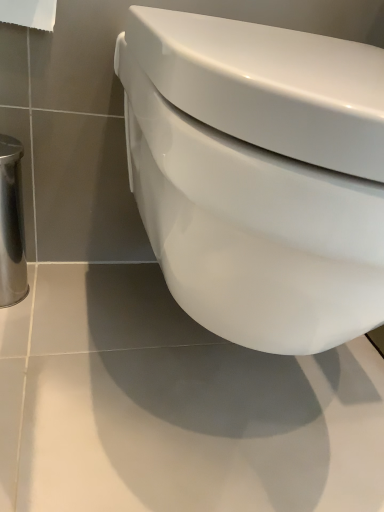
Describe the element at coordinates (258, 175) in the screenshot. I see `white glossy toilet at center` at that location.

What is the approximate width of white glossy toilet at center?

It is 20.89 inches.

Where is `white glossy toilet at center`? white glossy toilet at center is located at coordinates (258, 175).

From the picture: In order to face white paper at upper left, should I rotate leftwards or rightwards?

Turn left by 25.678 degrees to look at white paper at upper left.

Describe the element at coordinates (29, 13) in the screenshot. The width and height of the screenshot is (384, 512). I see `white paper at upper left` at that location.

At what (x,y) coordinates should I click in order to perform the action: click on white paper at upper left. Please return your answer as a coordinate pair (x, y). Looking at the image, I should click on 29,13.

Where is `white glossy toilet at center`? white glossy toilet at center is located at coordinates (258, 175).

Which object is positioned more to the right, white glossy toilet at center or white paper at upper left?

From the viewer's perspective, white glossy toilet at center appears more on the right side.

Does white glossy toilet at center lie behind white paper at upper left?

No, white glossy toilet at center is closer to the camera.

Is point (352, 64) farther from viewer compared to point (36, 4)?

No, it is in front of (36, 4).

From the image's perspective, is white glossy toilet at center positioned above or below white paper at upper left?

From the image's perspective, white glossy toilet at center appears below white paper at upper left.

From a real-world perspective, between white glossy toilet at center and white paper at upper left, who is vertically lower?

From a 3D spatial view, white glossy toilet at center is below.

In terms of width, does white glossy toilet at center look wider or thinner when compared to white paper at upper left?

In the image, white glossy toilet at center appears to be wider than white paper at upper left.

Looking at this image, does white glossy toilet at center have a greater height compared to white paper at upper left?

Yes.

Considering the sizes of objects white glossy toilet at center and white paper at upper left in the image provided, who is smaller, white glossy toilet at center or white paper at upper left?

Smaller between the two is white paper at upper left.

From the picture: Does white glossy toilet at center contain white paper at upper left?

No, white paper at upper left is not a part of white glossy toilet at center.

Is white glossy toilet at center touching white paper at upper left?

No, white glossy toilet at center is not beside white paper at upper left.

Is white glossy toilet at center facing away from white paper at upper left?

white glossy toilet at center is not turned away from white paper at upper left.

Can you tell me how much white glossy toilet at center and white paper at upper left differ in facing direction?

The angle between the facing direction of white glossy toilet at center and the facing direction of white paper at upper left is 0.106 degrees.

Find the location of `toilet that appears on the right of white paper at upper left`. toilet that appears on the right of white paper at upper left is located at coordinates (258, 175).

Is white paper at upper left at the left side of white glossy toilet at center?

Yes, white paper at upper left is to the left of white glossy toilet at center.

In the image, is white paper at upper left positioned in front of or behind white glossy toilet at center?

Clearly, white paper at upper left is behind white glossy toilet at center.

Which is in front, point (54, 7) or point (375, 275)?

The point (375, 275) is in front.

From the image's perspective, between white paper at upper left and white glossy toilet at center, who is located below?

white glossy toilet at center is shown below in the image.

From a real-world perspective, is white paper at upper left under white glossy toilet at center?

No, from a real-world perspective, white paper at upper left is not under white glossy toilet at center.

Considering the sizes of white paper at upper left and white glossy toilet at center in the image, is white paper at upper left wider or thinner than white glossy toilet at center?

Considering their sizes, white paper at upper left looks slimmer than white glossy toilet at center.

Does white paper at upper left have a lesser height compared to white glossy toilet at center?

Correct, white paper at upper left is not as tall as white glossy toilet at center.

Does white paper at upper left have a smaller size compared to white glossy toilet at center?

Indeed, white paper at upper left has a smaller size compared to white glossy toilet at center.

Which is correct: white paper at upper left is inside white glossy toilet at center, or outside of it?

The correct answer is: outside.

Are white paper at upper left and white glossy toilet at center beside each other?

No, white paper at upper left is not making contact with white glossy toilet at center.

Is white paper at upper left looking in the opposite direction of white glossy toilet at center?

No, white paper at upper left is not facing away from white glossy toilet at center.

Identify the location of toilet paper behind the white glossy toilet at center. The width and height of the screenshot is (384, 512). pos(29,13).

The height and width of the screenshot is (512, 384). I want to click on toilet in front of the white paper at upper left, so click(258, 175).

I want to click on toilet located underneath the white paper at upper left (from a real-world perspective), so tap(258, 175).